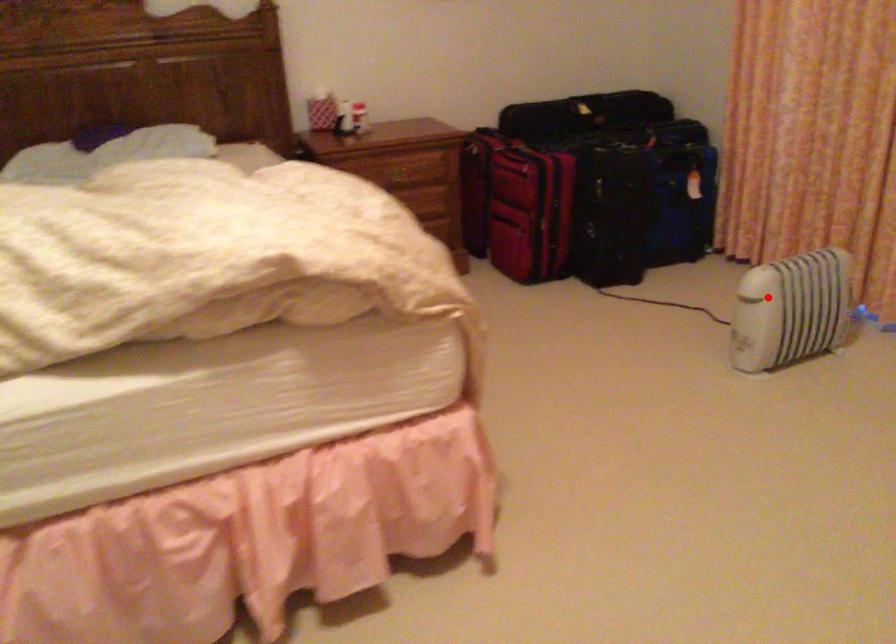
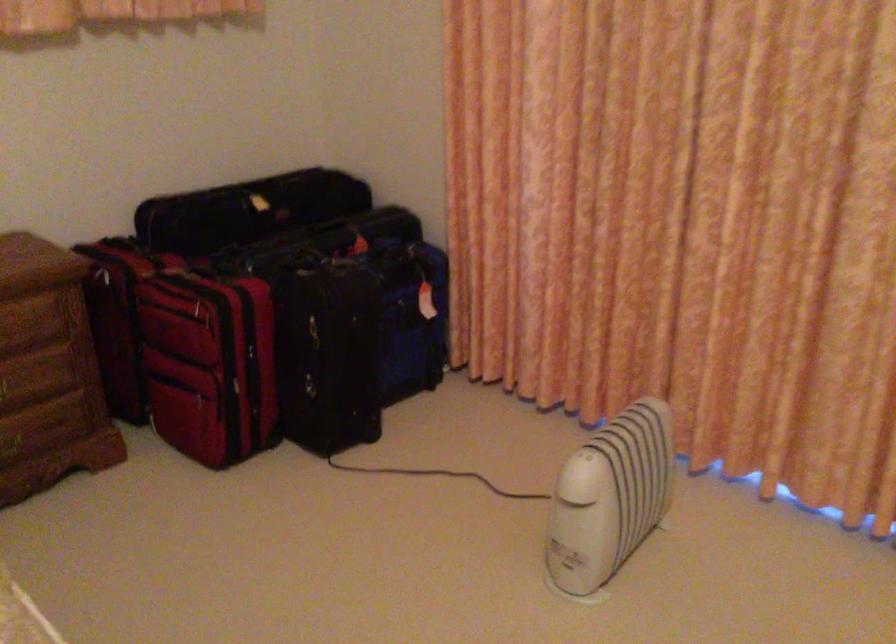
Question: I am providing you with two images of the same scene from different viewpoints. In image1, a red point is highlighted. Considering the same 3D point in image2, which of the following is correct?

Choices:
 (A) It is closer
 (B) It is farther

Answer: (A)